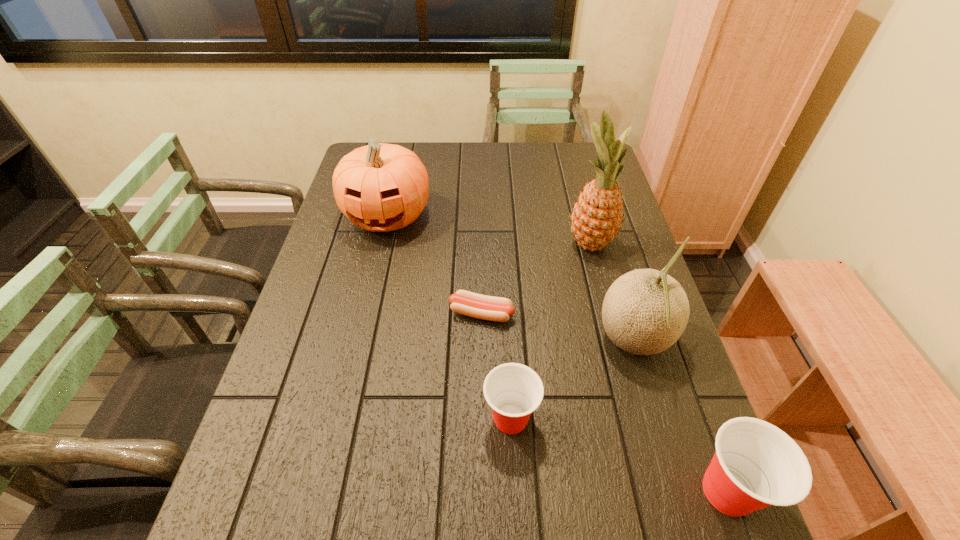
Locate an element on the screen. The image size is (960, 540). vacant area between the shortest object and the nearest object is located at coordinates (605, 402).

Identify the location of vacant region between the left cup and the pumpkin. The image size is (960, 540). (449, 317).

Locate an element on the screen. The height and width of the screenshot is (540, 960). empty space that is in between the cantaloup and the taller cup is located at coordinates (681, 416).

You are a GUI agent. You are given a task and a screenshot of the screen. Output one action in this format:
    pyautogui.click(x=<x>, y=<y>)
    Task: Click on the empty space between the leftmost object and the cantaloup
    Image resolution: width=960 pixels, height=540 pixels.
    Given the screenshot: What is the action you would take?
    pyautogui.click(x=511, y=279)

Select which object appears as the third closest to the fifth tallest object. Please provide its 2D coordinates. Your answer should be formatted as a tuple, i.e. [(x, y)], where the tuple contains the x and y coordinates of a point satisfying the conditions above.

[(756, 465)]

Choose which object is the fifth nearest neighbor to the pineapple. Please provide its 2D coordinates. Your answer should be formatted as a tuple, i.e. [(x, y)], where the tuple contains the x and y coordinates of a point satisfying the conditions above.

[(756, 465)]

Locate an element on the screen. The height and width of the screenshot is (540, 960). free space that satisfies the following two spatial constraints: 1. on the back side of the sausage; 2. on the right side of the tallest object is located at coordinates (481, 244).

Locate an element on the screen. This screenshot has height=540, width=960. blank space that satisfies the following two spatial constraints: 1. on the front-facing side of the leftmost object; 2. on the right side of the taller cup is located at coordinates [x=323, y=491].

This screenshot has width=960, height=540. I want to click on free space that satisfies the following two spatial constraints: 1. on the front-facing side of the sausage; 2. on the right side of the pumpkin, so click(x=365, y=313).

Locate an element on the screen. This screenshot has width=960, height=540. free space that satisfies the following two spatial constraints: 1. on the front-facing side of the tallest object; 2. on the left side of the leftmost object is located at coordinates (381, 244).